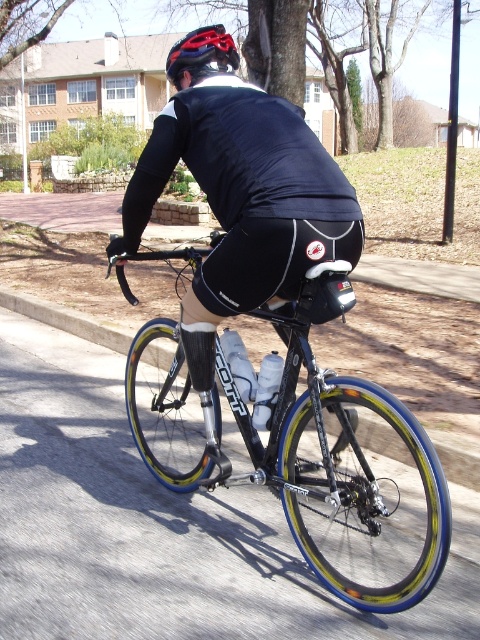
Is black matte bicycle at center taller than matte black helmet at upper center?

No.

Can you confirm if black matte bicycle at center is positioned above matte black helmet at upper center?

No, black matte bicycle at center is not above matte black helmet at upper center.

Find the location of a particular element. black matte bicycle at center is located at coordinates (302, 449).

Image resolution: width=480 pixels, height=640 pixels. I want to click on black matte bicycle at center, so click(302, 449).